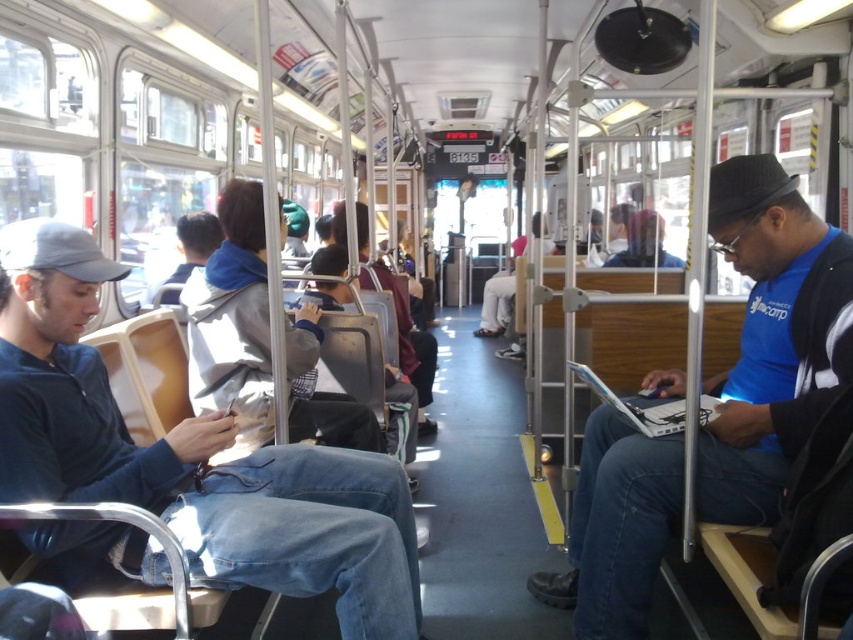
Can you confirm if denim jeans at left is smaller than blue fabric shirt at center?

Indeed, denim jeans at left has a smaller size compared to blue fabric shirt at center.

Can you confirm if denim jeans at left is thinner than blue fabric shirt at center?

Incorrect, denim jeans at left's width is not less than blue fabric shirt at center's.

What do you see at coordinates (189, 458) in the screenshot?
I see `denim jeans at left` at bounding box center [189, 458].

At what (x,y) coordinates should I click in order to perform the action: click on denim jeans at left. Please return your answer as a coordinate pair (x, y). The image size is (853, 640). Looking at the image, I should click on (189, 458).

The image size is (853, 640). Find the location of `blue fabric shirt at center`. blue fabric shirt at center is located at coordinates (770, 337).

Between blue fabric shirt at center and white plastic laptop at right, which one has more height?

With more height is blue fabric shirt at center.

Is point (817, 390) less distant than point (656, 420)?

Yes, point (817, 390) is closer to viewer.

Locate an element on the screen. Image resolution: width=853 pixels, height=640 pixels. blue fabric shirt at center is located at coordinates (770, 337).

Who is positioned more to the left, denim jeans at left or white plastic laptop at right?

denim jeans at left

Is point (152, 577) positioned after point (582, 381)?

No.

Where is `denim jeans at left`? This screenshot has width=853, height=640. denim jeans at left is located at coordinates (189, 458).